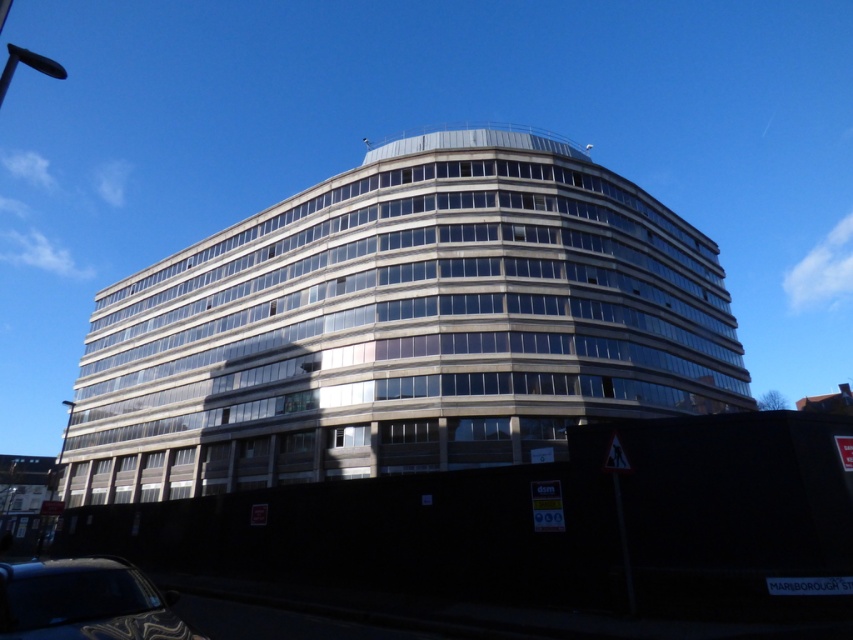
You are a photographer planning to capture the white concrete building at center and the shiny black car at lower left in a single shot. Based on their sizes in the image, which object would appear larger in the photo?

The white concrete building at center appears larger in the photo because its width surpasses that of the shiny black car at lower left.

You are a delivery driver approaching the white concrete building at center and the shiny black car at lower left. Based on the scene, which object is closer to the ground?

The white concrete building at center is located below the shiny black car at lower left, so it is closer to the ground.